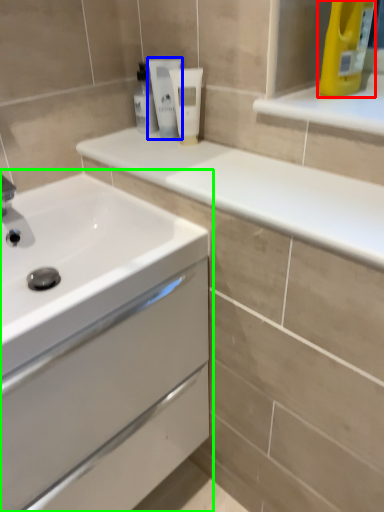
Question: Which is farther away from cleaning product (highlighted by a red box)? mouthwash (highlighted by a blue box) or bathroom cabinet (highlighted by a green box)?

Choices:
 (A) mouthwash
 (B) bathroom cabinet

Answer: (B)